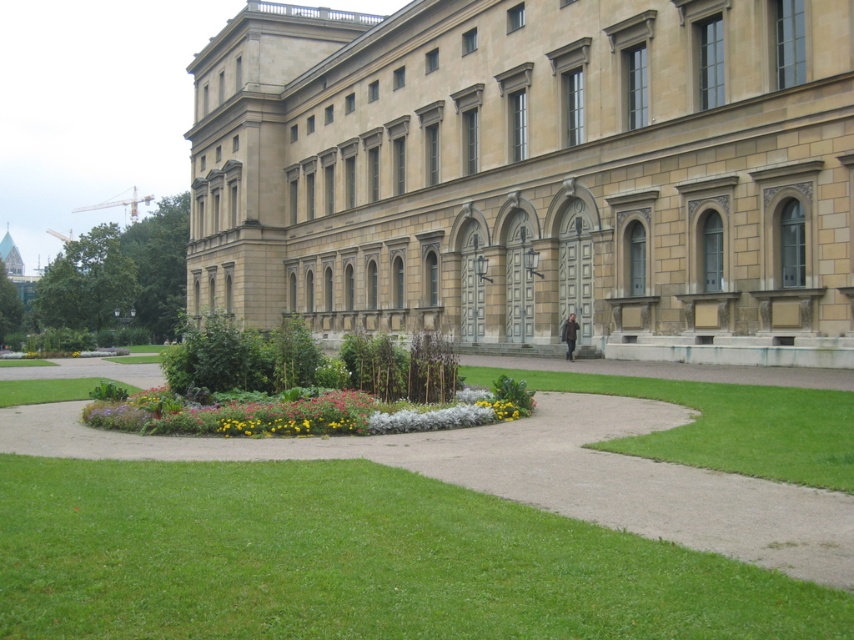
You are standing in the garden and want to walk to the beige stone building at center. Which direction should you move relative to the green grass at center?

Since the green grass at center is behind the beige stone building at center, you should move forward towards the beige stone building at center, away from the green grass at center.

You are a landscape architect planning to install a new statue in the garden. The statue will be placed between the beige stone building at center and the green grass at center. Considering their heights, which object will the statue be taller than?

The beige stone building at center has a greater height compared to green grass at center. Therefore, the statue will be taller than the green grass at center if it is placed between them.

You are a gardener standing on the green grass at center. You want to water the beige stone building at center using a hose that can reach up to 35 meters. Is the hose long enough to reach the building from your current position?

The distance between the beige stone building at center and the green grass at center is 38.36 meters. Since the hose can only reach up to 35 meters, it is not long enough to water the beige stone building at center from the green grass at center.